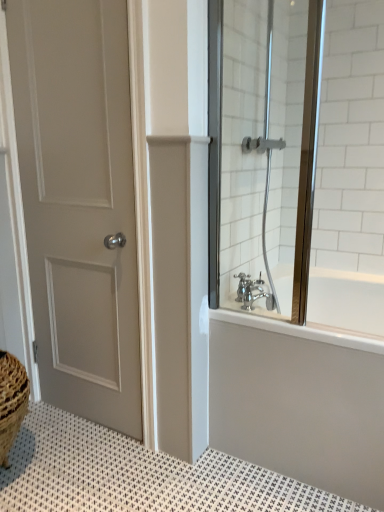
Question: From the image's perspective, is silver metallic faucet at lower right below white glossy bathtub at upper right?

Choices:
 (A) yes
 (B) no

Answer: (B)

Question: Considering the relative sizes of silver metallic faucet at lower right and white glossy bathtub at upper right in the image provided, is silver metallic faucet at lower right smaller than white glossy bathtub at upper right?

Choices:
 (A) yes
 (B) no

Answer: (A)

Question: Are silver metallic faucet at lower right and white glossy bathtub at upper right making contact?

Choices:
 (A) yes
 (B) no

Answer: (B)

Question: Is silver metallic faucet at lower right far from white glossy bathtub at upper right?

Choices:
 (A) no
 (B) yes

Answer: (A)

Question: Considering the relative positions of silver metallic faucet at lower right and white glossy bathtub at upper right in the image provided, is silver metallic faucet at lower right to the right of white glossy bathtub at upper right from the viewer's perspective?

Choices:
 (A) no
 (B) yes

Answer: (A)

Question: In terms of height, does white textured bath mat at lower left look taller or shorter compared to clear glass shower door at right?

Choices:
 (A) tall
 (B) short

Answer: (B)

Question: Is white textured bath mat at lower left inside the boundaries of clear glass shower door at right, or outside?

Choices:
 (A) outside
 (B) inside

Answer: (A)

Question: From the image's perspective, is white textured bath mat at lower left above or below clear glass shower door at right?

Choices:
 (A) above
 (B) below

Answer: (B)

Question: Looking at the image, does white textured bath mat at lower left seem bigger or smaller compared to clear glass shower door at right?

Choices:
 (A) big
 (B) small

Answer: (B)

Question: From the image's perspective, is matte gray door at left positioned above or below clear glass shower door at right?

Choices:
 (A) above
 (B) below

Answer: (B)

Question: Do you think matte gray door at left is within clear glass shower door at right, or outside of it?

Choices:
 (A) outside
 (B) inside

Answer: (A)

Question: In the image, is matte gray door at left positioned in front of or behind clear glass shower door at right?

Choices:
 (A) behind
 (B) front

Answer: (A)

Question: Is point (137, 407) positioned closer to the camera than point (246, 156)?

Choices:
 (A) closer
 (B) farther

Answer: (B)

Question: In terms of size, does white textured bath mat at lower left appear bigger or smaller than silver metallic faucet at lower right?

Choices:
 (A) big
 (B) small

Answer: (A)

Question: From a real-world perspective, relative to silver metallic faucet at lower right, is white textured bath mat at lower left vertically above or below?

Choices:
 (A) below
 (B) above

Answer: (A)